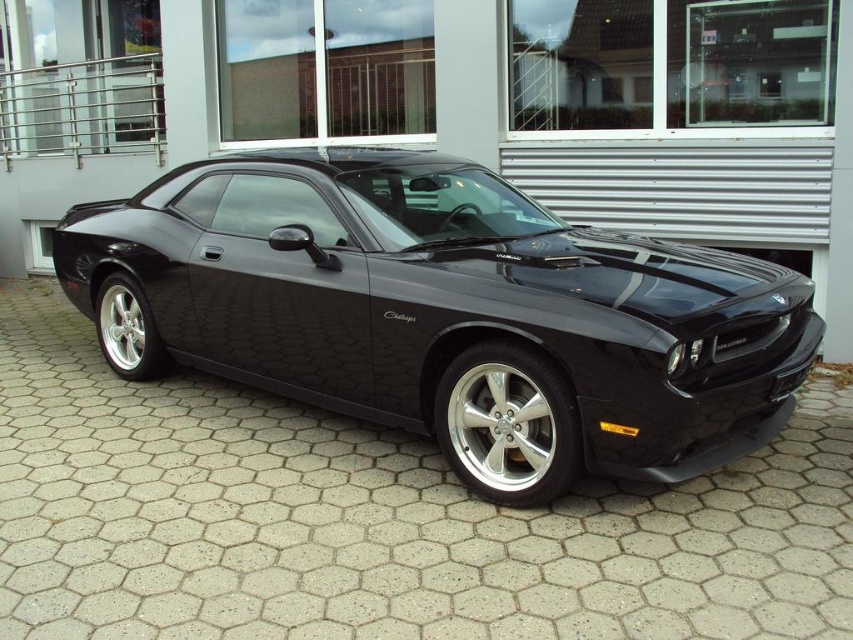
You are standing in front of the black Dodge Challenger and want to take a photo of the car. If you focus on point 1 at point (485, 592) and then shift your focus to point 2 at (541, 419), will the second point be closer or farther from the camera compared to the first point?

The second point at point (541, 419) is farther from the camera than the first point at point (485, 592), since point (485, 592) is closer to the camera than point (541, 419).

What is the exact coordinate of the black asphalt driveway at center?

The black asphalt driveway at center is located at point (376, 518).

You are standing at the point marked by the coordinates point (376, 518). Looking around, you see the black Dodge Challenger parked on a hexagonal paving surface. What is the surface you are currently standing on?

The point (376, 518) indicates the black asphalt driveway at center, so you are standing on the black asphalt driveway at center.